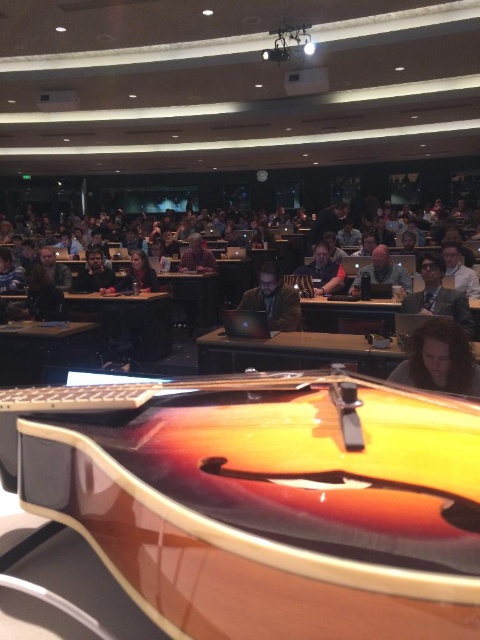
Question: Which of the following is the closest to the observer?

Choices:
 (A) (229, 355)
 (B) (381, 278)
 (C) (91, 248)
 (D) (456, 276)

Answer: (A)

Question: Is matte brown hair at center below matte black laptop at center?

Choices:
 (A) no
 (B) yes

Answer: (B)

Question: Considering the relative positions of matte black glasses at upper right and matte black laptop at center in the image provided, where is matte black glasses at upper right located with respect to matte black laptop at center?

Choices:
 (A) below
 (B) above

Answer: (A)

Question: Is matte brown guitar at center to the left of matte brown hair at center from the viewer's perspective?

Choices:
 (A) yes
 (B) no

Answer: (A)

Question: Which object appears farthest from the camera in this image?

Choices:
 (A) matte black glasses at upper right
 (B) wooden guitar at center
 (C) matte brown guitar at center
 (D) brown wood table at center

Answer: (B)

Question: Which point is closer to the camera taking this photo?

Choices:
 (A) (208, 253)
 (B) (101, 256)
 (C) (224, 356)
 (D) (332, 259)

Answer: (C)